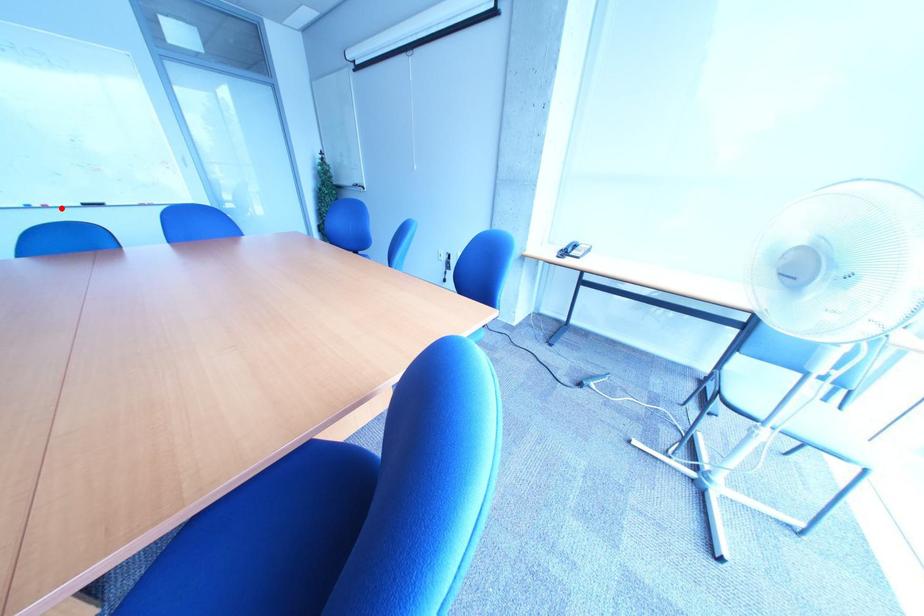
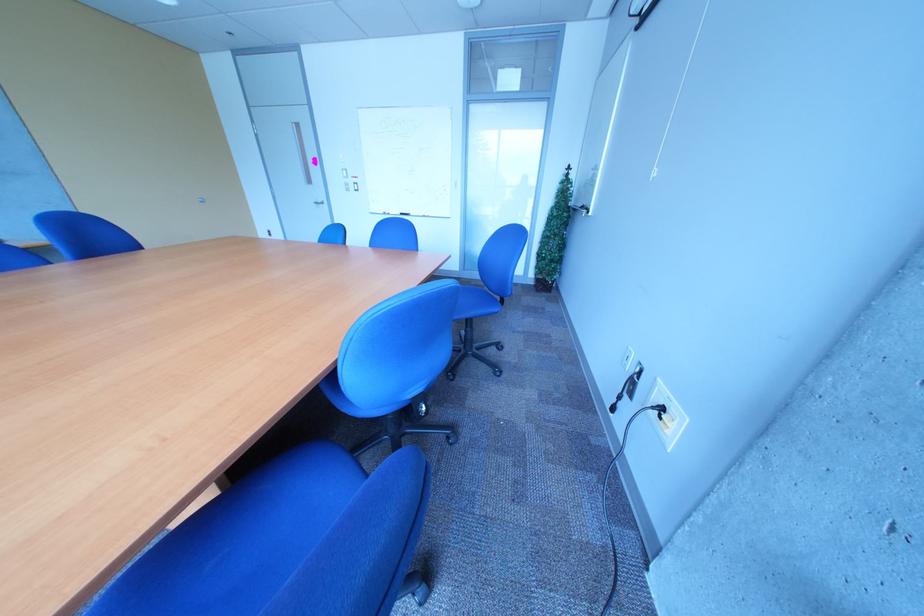
Question: A red point is marked in image1. In image2, is the corresponding 3D point closer to the camera or farther? Reply with the corresponding letter.

Choices:
 (A) The corresponding 3D point is closer.
 (B) The corresponding 3D point is farther.

Answer: (A)